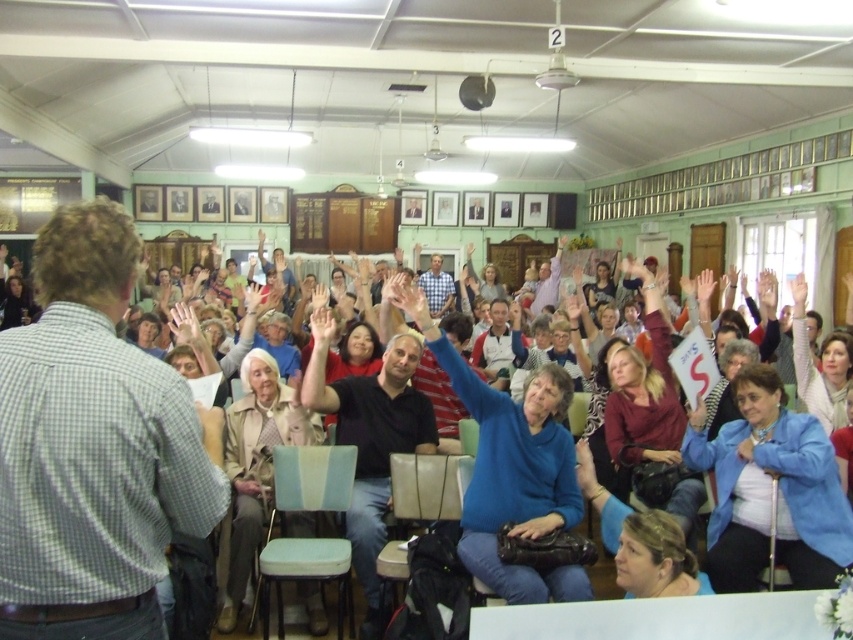
Question: Which point is closer to the camera taking this photo?

Choices:
 (A) (392, 381)
 (B) (664, 435)
 (C) (567, 454)
 (D) (230, 596)

Answer: (C)

Question: Can you confirm if blue shirt at left is positioned to the left of blue matte sweater at center?

Choices:
 (A) yes
 (B) no

Answer: (A)

Question: Is blue matte sweater at center below maroon fabric sweater at center?

Choices:
 (A) yes
 (B) no

Answer: (B)

Question: Is light beige fabric jacket at center bigger than maroon fabric sweater at center?

Choices:
 (A) yes
 (B) no

Answer: (B)

Question: Which object is farther from the camera taking this photo?

Choices:
 (A) dark blue shirt at center
 (B) blue matte sweater at center

Answer: (A)

Question: Which point is closer to the camera?

Choices:
 (A) (791, 486)
 (B) (250, 566)

Answer: (A)